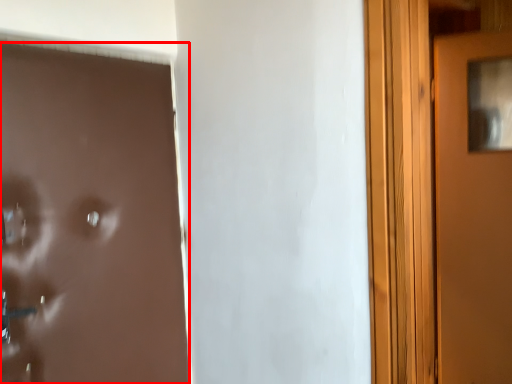
Question: Considering the relative positions of door (annotated by the red box) and door in the image provided, where is door (annotated by the red box) located with respect to the staircase?

Choices:
 (A) left
 (B) right

Answer: (A)